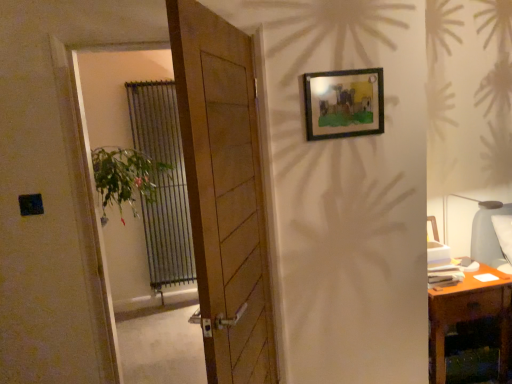
Locate an element on the screen. free region under metallic silver radiator at left (from a real-world perspective) is located at coordinates (169, 312).